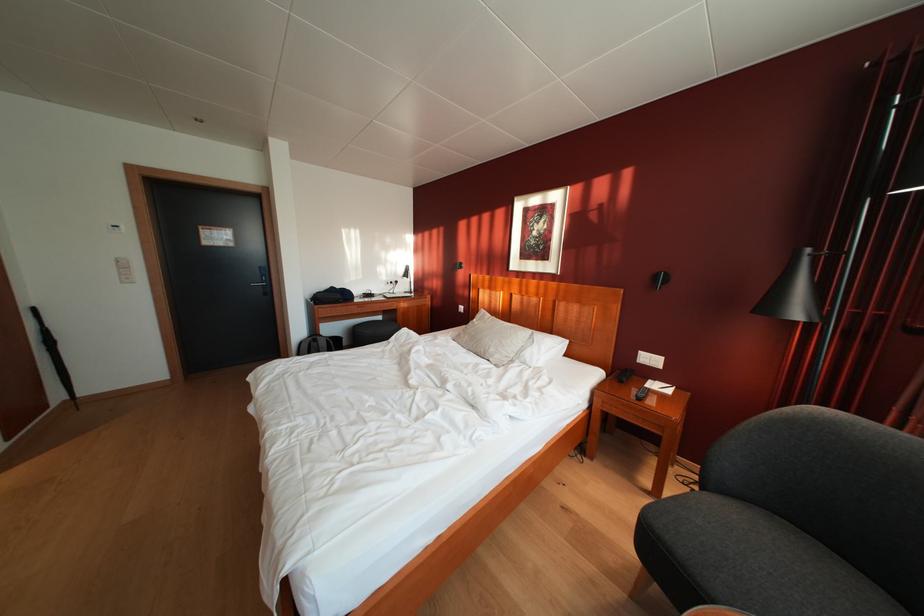
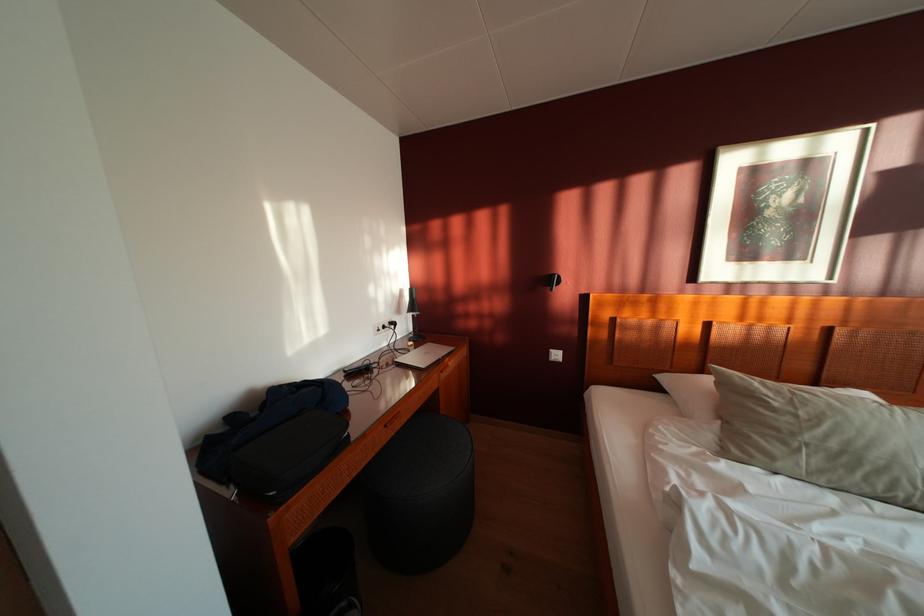
What movement of the cameraman would produce the second image?

The movement direction of the cameraman is left, forward.